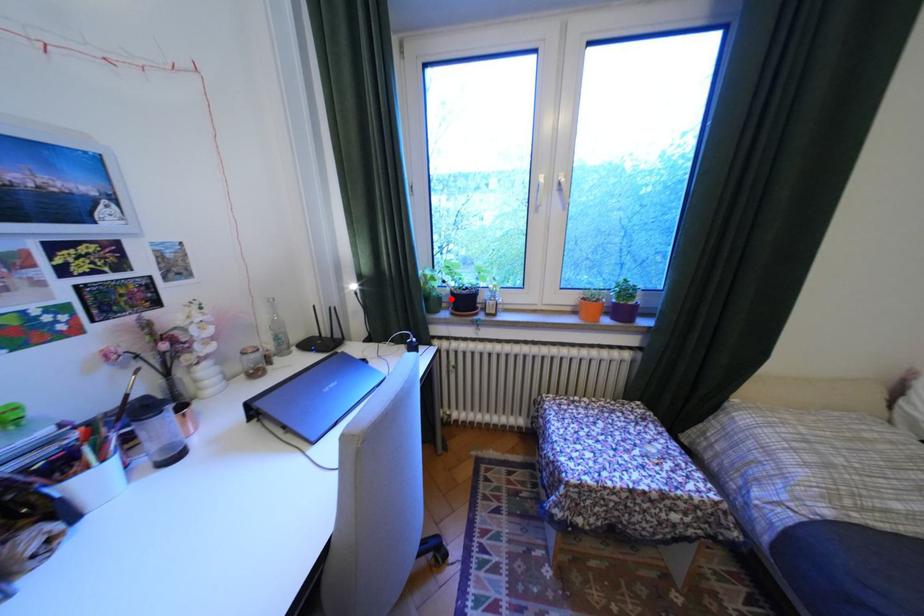
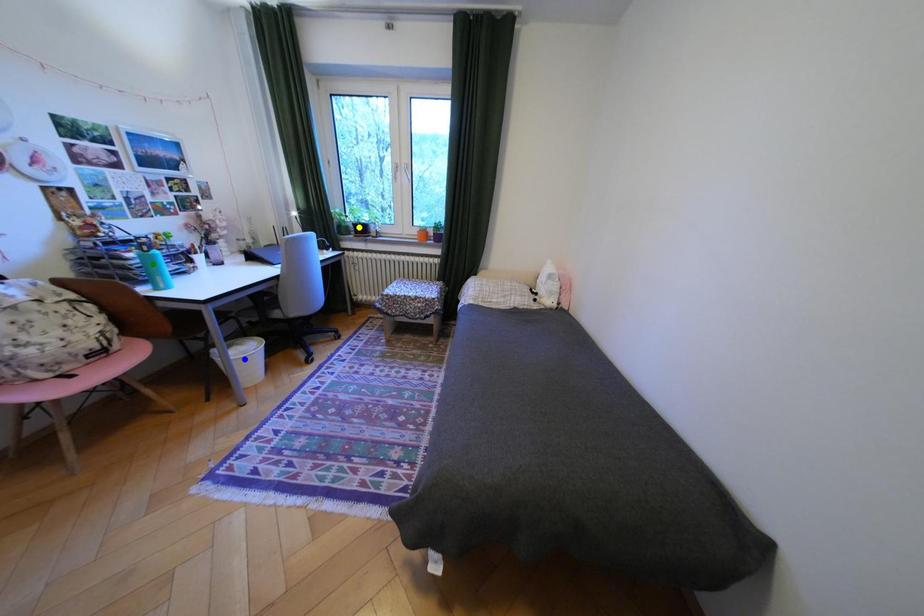
Question: I am providing you with two images of the same scene from different viewpoints. A red point is marked on the first image. You are given multiple points on the second image. Which spot in image 2 lines up with the point in image 1?

Choices:
 (A) green point
 (B) yellow point
 (C) blue point

Answer: (B)